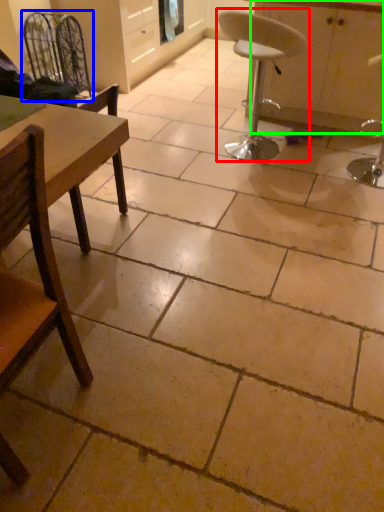
Question: Estimate the real-world distances between objects in this image. Which object is closer to chair (highlighted by a red box), swivel chair (highlighted by a blue box) or cabinetry (highlighted by a green box)?

Choices:
 (A) swivel chair
 (B) cabinetry

Answer: (B)